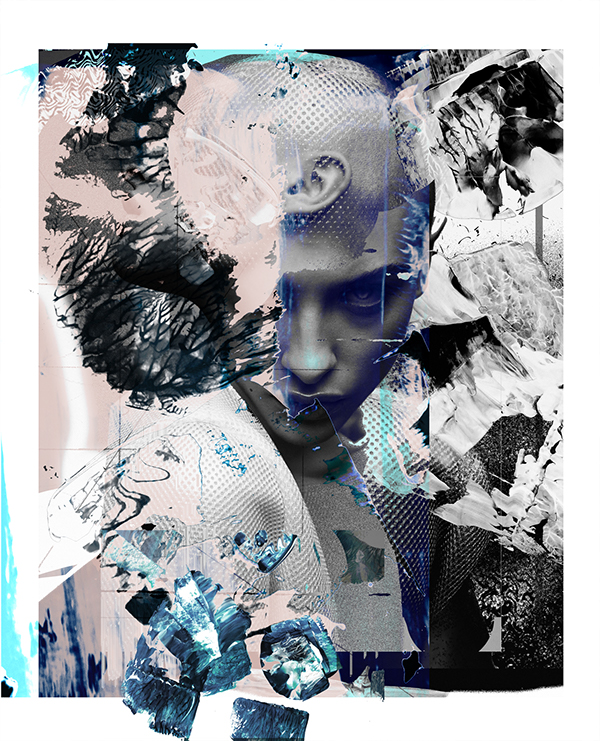
Where is `art`? art is located at coordinates (x=431, y=407).